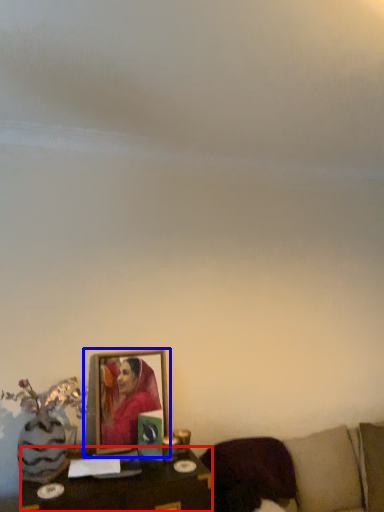
Question: Which object appears closest to the camera in this image, table (highlighted by a red box) or picture frame (highlighted by a blue box)?

Choices:
 (A) table
 (B) picture frame

Answer: (A)